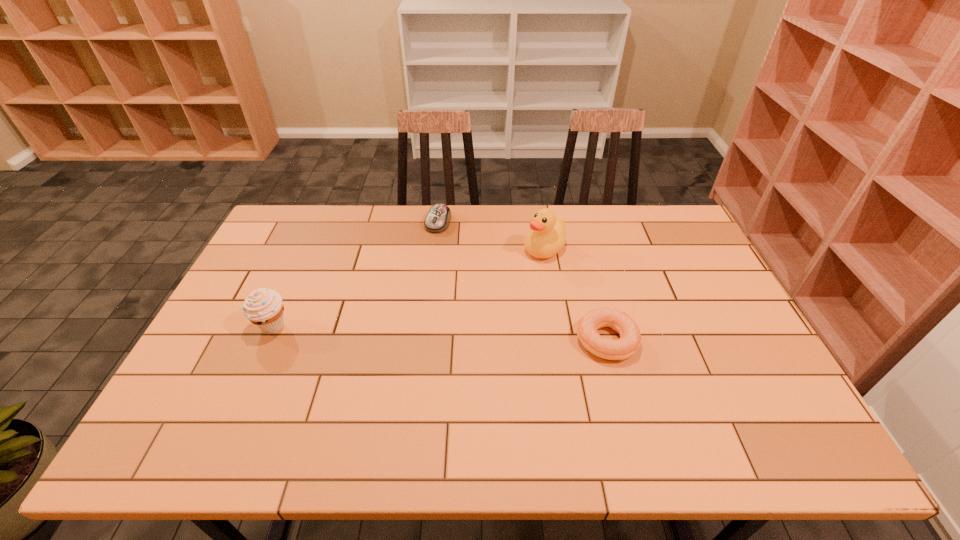
Where is `vacant space at the left edge of the desktop`? This screenshot has width=960, height=540. vacant space at the left edge of the desktop is located at coordinates (214, 373).

In the image, there is a desktop. Identify the location of vacant space at the right edge. (698, 355).

At what (x,y) coordinates should I click in order to perform the action: click on blank space at the far left corner of the desktop. Please return your answer as a coordinate pair (x, y). This screenshot has height=540, width=960. Looking at the image, I should click on (315, 217).

This screenshot has height=540, width=960. I want to click on free space between the duck and the bagel, so click(575, 295).

Locate an element on the screen. free space that is in between the muffin and the tallest object is located at coordinates (408, 288).

The image size is (960, 540). Find the location of `unoccupied area between the computer mouse and the muffin`. unoccupied area between the computer mouse and the muffin is located at coordinates (355, 274).

The width and height of the screenshot is (960, 540). I want to click on free area in between the bagel and the leftmost object, so click(x=440, y=333).

Where is `unoccupied position between the third object from right to left and the bagel`? The height and width of the screenshot is (540, 960). unoccupied position between the third object from right to left and the bagel is located at coordinates 522,281.

This screenshot has width=960, height=540. Identify the location of unoccupied position between the tallest object and the leftmost object. (408, 288).

Where is `vacant space in between the second object from left to right and the third nearest object`? vacant space in between the second object from left to right and the third nearest object is located at coordinates (492, 236).